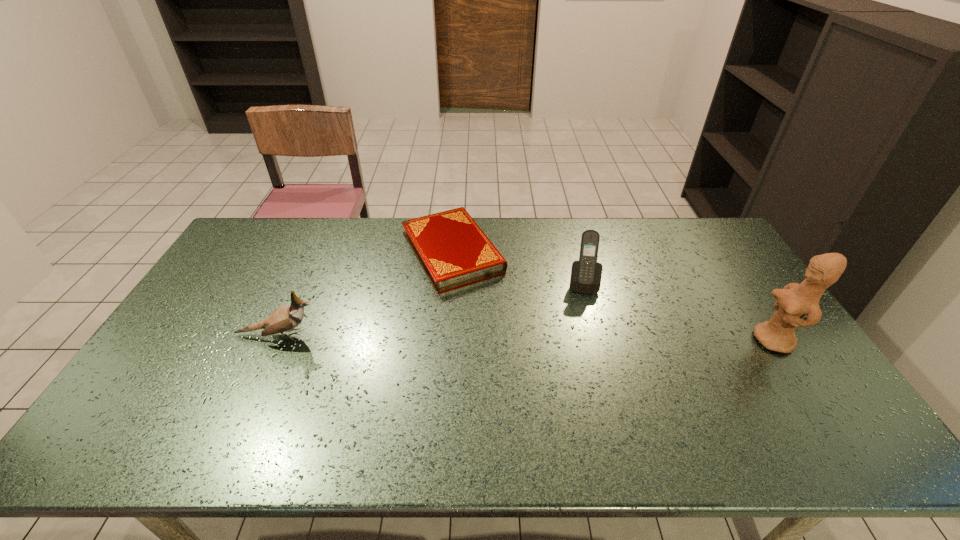
Locate an element on the screen. free space between the cellular telephone and the shortest object is located at coordinates (517, 268).

Image resolution: width=960 pixels, height=540 pixels. Find the location of `vacant point located between the shortest object and the tallest object`. vacant point located between the shortest object and the tallest object is located at coordinates (612, 296).

Where is `empty space that is in between the third object from left to right and the bird`? empty space that is in between the third object from left to right and the bird is located at coordinates (430, 309).

This screenshot has height=540, width=960. I want to click on object that stands as the third closest to the bird, so click(795, 300).

The image size is (960, 540). What are the coordinates of `object that can be found as the third closest to the leftmost object` in the screenshot? It's located at (795, 300).